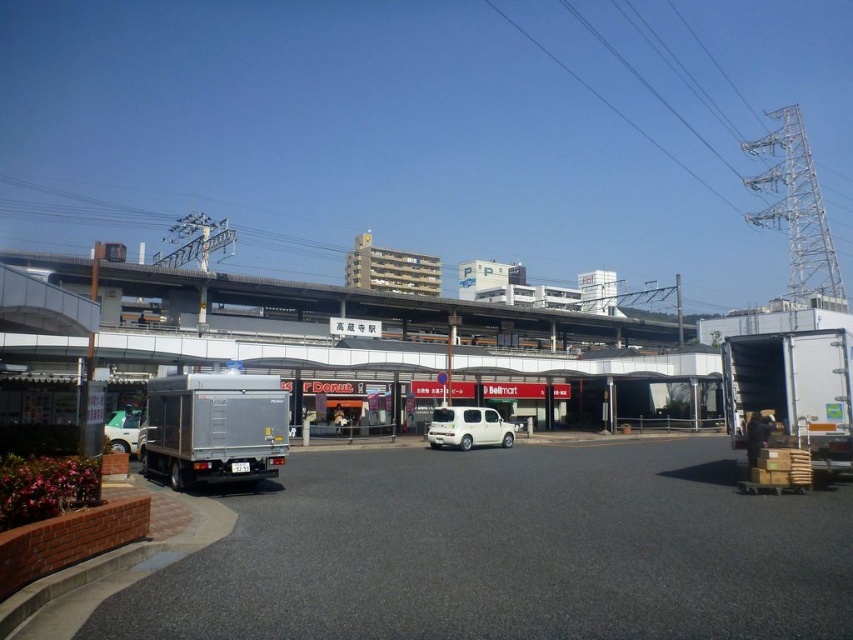
Is point (833, 289) closer to camera compared to point (438, 426)?

No, it is not.

Looking at this image, can you confirm if white metallic power line at upper right is thinner than white matte van at center?

Incorrect, white metallic power line at upper right's width is not less than white matte van at center's.

Is point (578, 77) farther from camera compared to point (451, 426)?

That is True.

Identify the location of white metallic power line at upper right. (724, 196).

Which of these two, metallic gray overpass at center or white matte van at center, stands taller?

Standing taller between the two is metallic gray overpass at center.

Does metallic gray overpass at center have a lesser width compared to white matte van at center?

No.

Is point (415, 317) closer to camera compared to point (437, 408)?

No, (415, 317) is further to viewer.

Where is `metallic gray overpass at center`? metallic gray overpass at center is located at coordinates (376, 305).

Does point (260, 374) lie behind point (851, 337)?

That is True.

Who is taller, silver metallic trailer truck at lower left or white matte truck at right?

white matte truck at right is taller.

You are a GUI agent. You are given a task and a screenshot of the screen. Output one action in this format:
    pyautogui.click(x=<x>, y=<y>)
    Task: Click on the silver metallic trailer truck at lower left
    The image size is (853, 640).
    Given the screenshot: What is the action you would take?
    pyautogui.click(x=213, y=428)